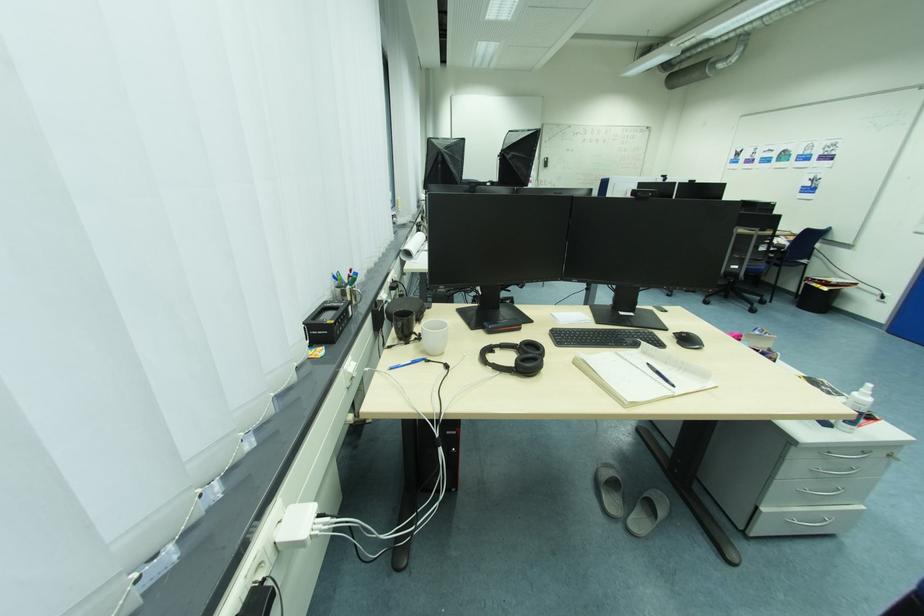
Describe the element at coordinates (777, 240) in the screenshot. Image resolution: width=924 pixels, height=616 pixels. I see `a chair armrest` at that location.